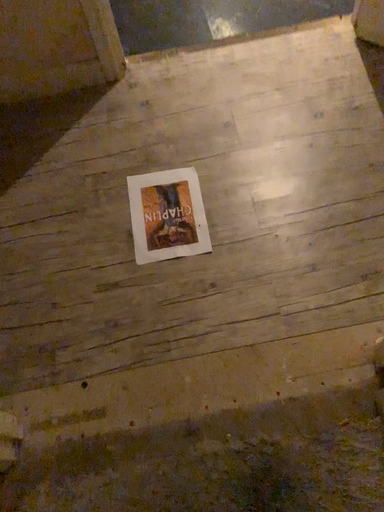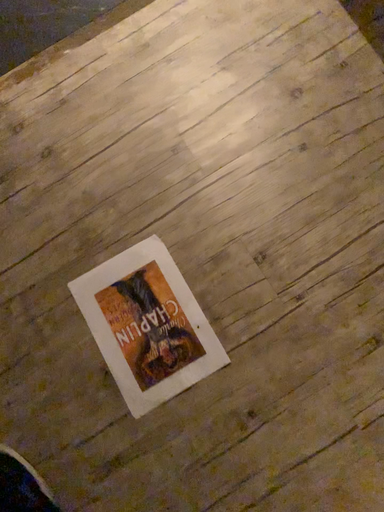
Question: Which way did the camera rotate in the video?

Choices:
 (A) rotated right
 (B) rotated left

Answer: (A)